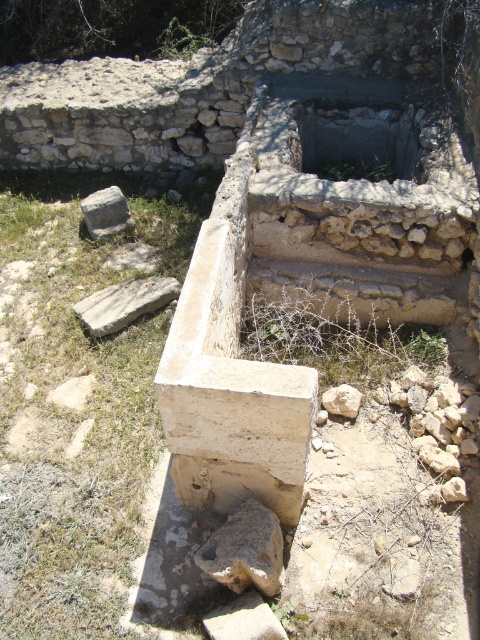
Looking at this image, you are an archaeologist examining the ancient structure. You notice two stones in the area. The first is the brown rough stone at lower center, and the second is the light brown stone at lower left. From your position, which stone is positioned more to the right?

The brown rough stone at lower center is positioned more to the right than the light brown stone at lower left.

You are an archaeologist examining the ancient structure. You notice two stones at the lower left corner of the basin. Which stone is positioned closer to you, the light brown stone at lower left or the gray rough stone at lower left?

The light brown stone at lower left is closer to the viewer than the gray rough stone at lower left, so the light brown stone at lower left is positioned closer to you.

You are an archaeologist examining the ancient structure. You notice the brown rough stone at lower center and the light brown stone at lower left. Which stone is taller?

The light brown stone at lower left is taller than the brown rough stone at lower center.